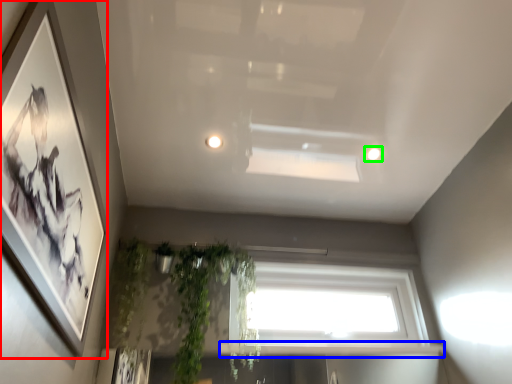
Question: Which object is the farthest from picture frame (highlighted by a red box)? Choose among these: window sill (highlighted by a blue box) or lighting (highlighted by a green box).

Choices:
 (A) window sill
 (B) lighting

Answer: (B)